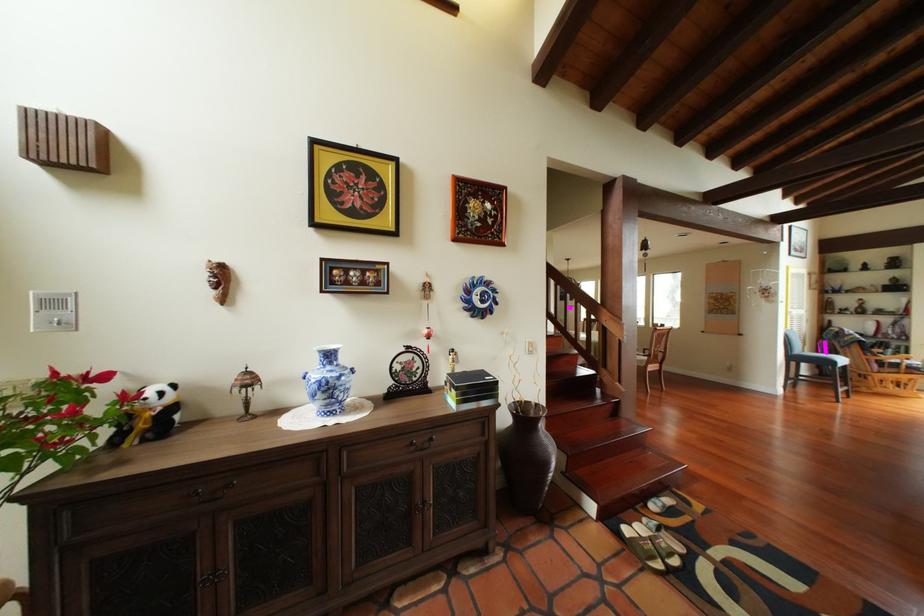
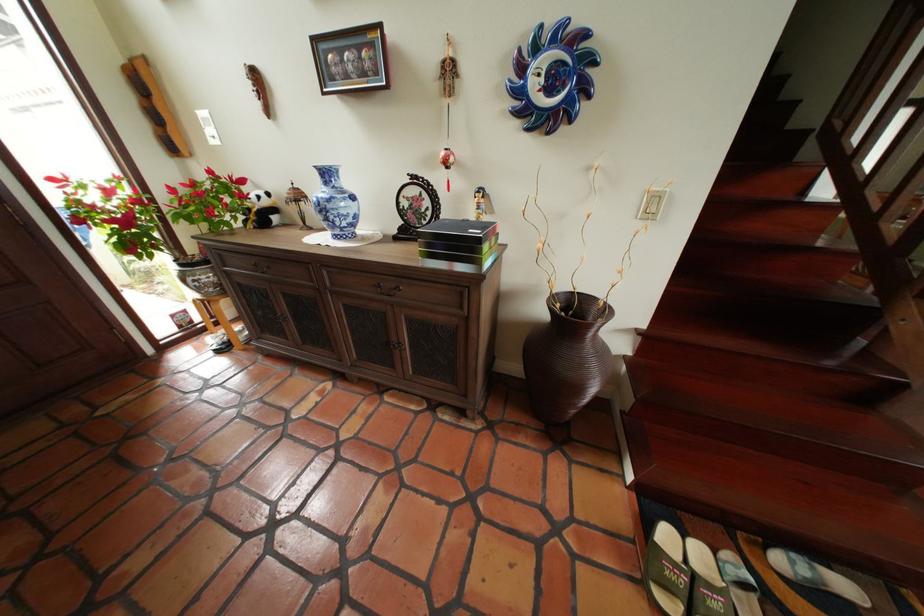
The point at (494, 302) is marked in the first image. Where is the corresponding point in the second image?

(563, 91)